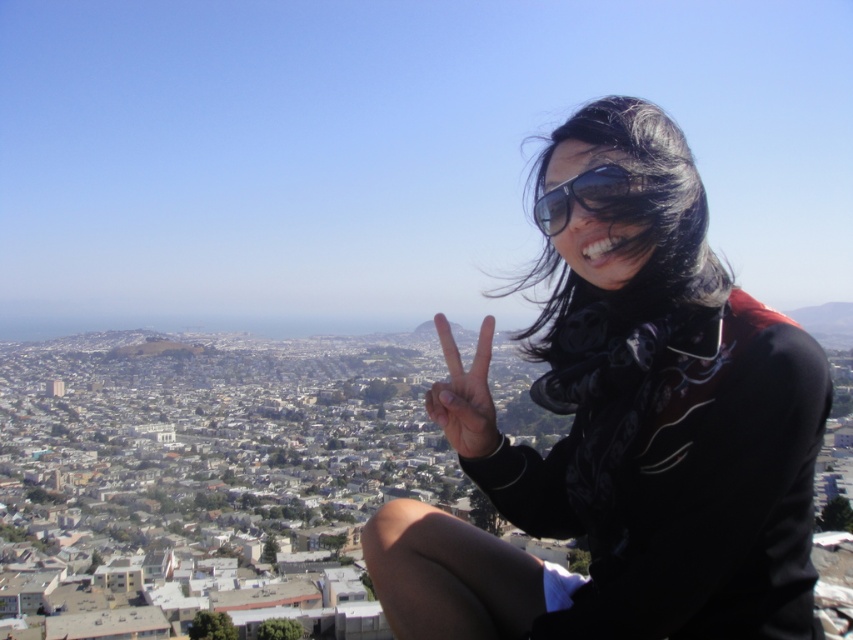
Is black matte scarf at right wider than matte skin hand at center?

Correct, the width of black matte scarf at right exceeds that of matte skin hand at center.

The width and height of the screenshot is (853, 640). What are the coordinates of `black matte scarf at right` in the screenshot? It's located at (634, 433).

This screenshot has width=853, height=640. What are the coordinates of `black matte scarf at right` in the screenshot? It's located at pyautogui.click(x=634, y=433).

In order to click on matte skin hand at center in this screenshot , I will do `click(463, 394)`.

Is matte skin hand at center wider than sunglasses at upper right?

Yes, matte skin hand at center is wider than sunglasses at upper right.

Is point (451, 348) in front of point (554, 225)?

No, (451, 348) is further to viewer.

This screenshot has width=853, height=640. In order to click on matte skin hand at center in this screenshot , I will do `click(463, 394)`.

Can you confirm if black matte scarf at right is smaller than sunglasses at upper right?

Incorrect, black matte scarf at right is not smaller in size than sunglasses at upper right.

Which is behind, point (572, 602) or point (553, 236)?

Point (553, 236)

I want to click on black matte scarf at right, so click(634, 433).